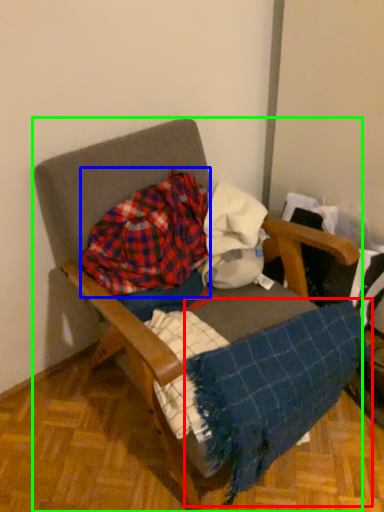
Question: Estimate the real-world distances between objects in this image. Which object is closer to blanket (highlighted by a red box), flannel (highlighted by a blue box) or furniture (highlighted by a green box)?

Choices:
 (A) flannel
 (B) furniture

Answer: (B)